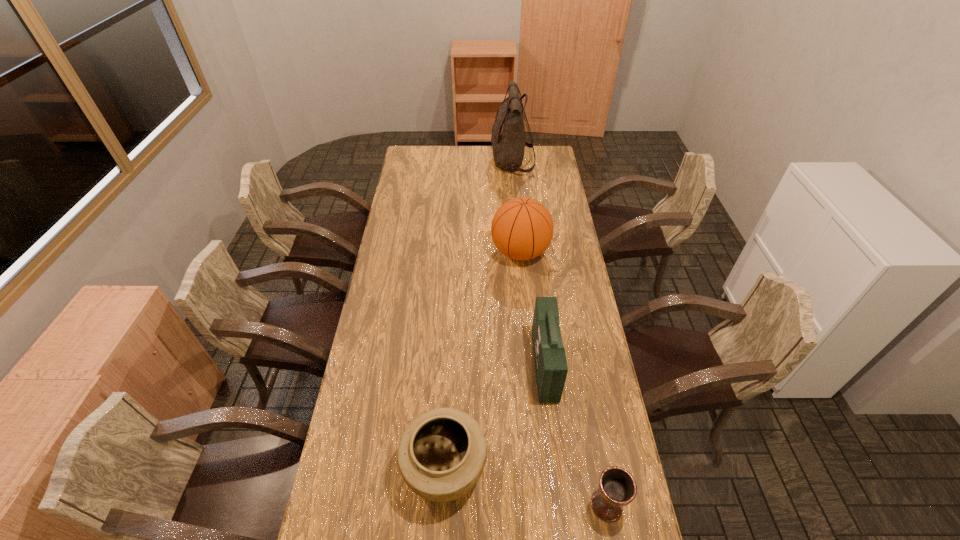
At what (x,y) coordinates should I click in order to perform the action: click on backpack. Please return your answer as a coordinate pair (x, y). The height and width of the screenshot is (540, 960). Looking at the image, I should click on (508, 143).

Find the location of a particular element. This screenshot has height=540, width=960. the tallest object is located at coordinates (508, 143).

You are a GUI agent. You are given a task and a screenshot of the screen. Output one action in this format:
    pyautogui.click(x=<x>, y=<y>)
    Task: Click on the second farthest object
    This screenshot has width=960, height=540.
    Given the screenshot: What is the action you would take?
    pyautogui.click(x=522, y=228)

I want to click on the third farthest object, so click(x=551, y=368).

This screenshot has height=540, width=960. Find the location of `the third shortest object`. the third shortest object is located at coordinates (551, 368).

Locate an element on the screen. This screenshot has height=540, width=960. pottery is located at coordinates (441, 455).

You are a GUI agent. You are given a task and a screenshot of the screen. Output one action in this format:
    pyautogui.click(x=<x>, y=<y>)
    Task: Click on the chalice
    This screenshot has height=540, width=960.
    Given the screenshot: What is the action you would take?
    pos(617,488)

You are a GUI agent. You are given a task and a screenshot of the screen. Output one action in this format:
    pyautogui.click(x=<x>, y=<y>)
    Task: Click on the free space located on the open flap of the backpack
    The height and width of the screenshot is (540, 960).
    Given the screenshot: What is the action you would take?
    pyautogui.click(x=434, y=162)

Identify the location of vacant region located on the open flap of the backpack. The height and width of the screenshot is (540, 960). (468, 162).

At what (x,y) coordinates should I click in order to perform the action: click on free space located 0.220m on the open flap of the backpack. Please return your answer as a coordinate pair (x, y). This screenshot has width=960, height=540. Looking at the image, I should click on point(450,162).